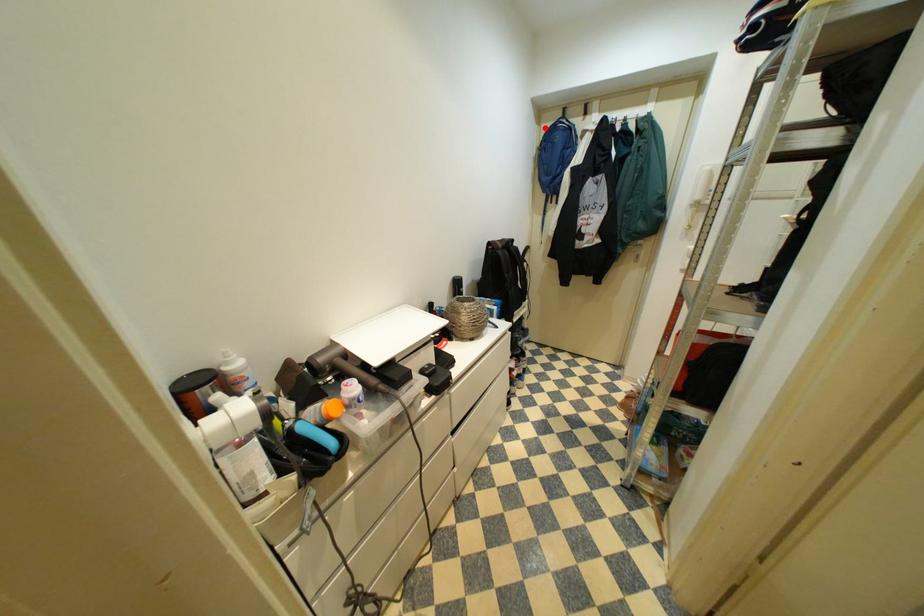
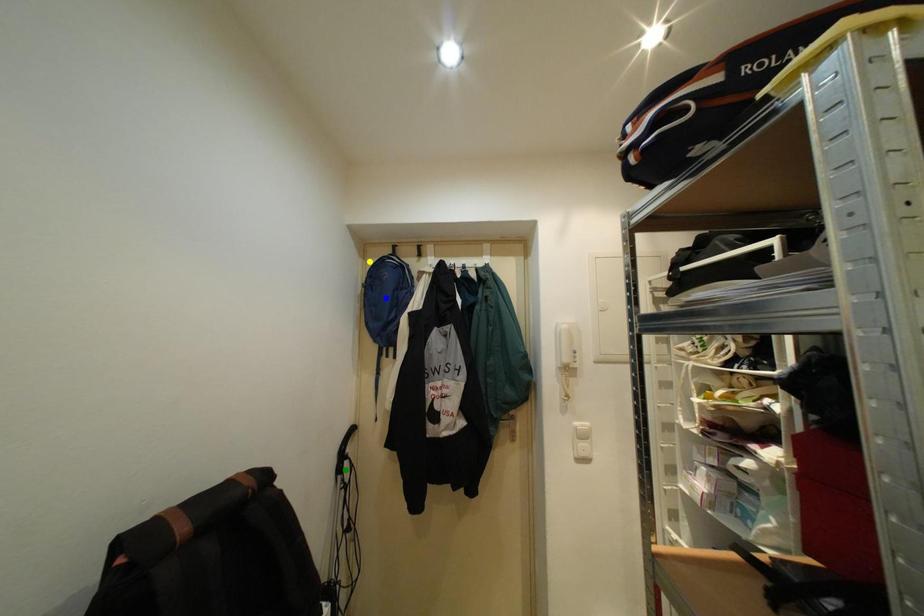
Question: I am providing you with two images of the same scene from different viewpoints. A red point is marked on the first image. You are given multiple points on the second image. Can you choose the point in image 2 that corresponds to the point in image 1?

Choices:
 (A) green point
 (B) yellow point
 (C) blue point

Answer: (B)